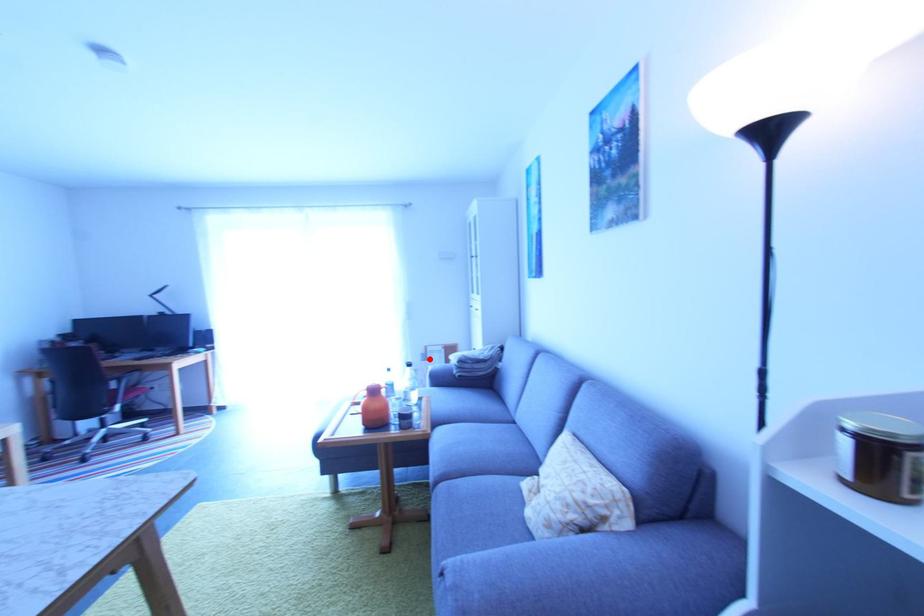
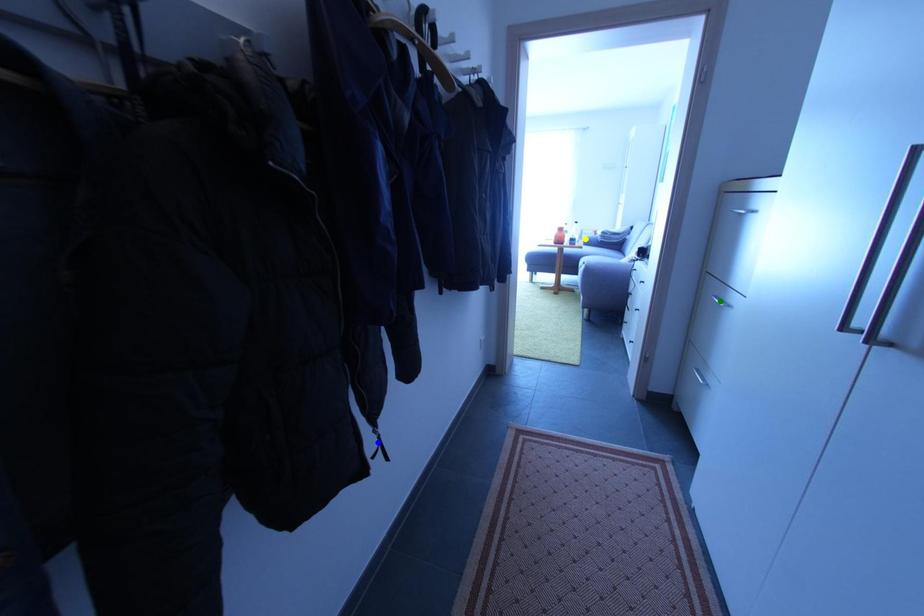
Question: I am providing you with two images of the same scene from different viewpoints. A red point is marked on the first image. You are given multiple points on the second image. Can you choose the point in image 2 that corresponds to the point in image 1?

Choices:
 (A) blue point
 (B) yellow point
 (C) green point

Answer: (B)